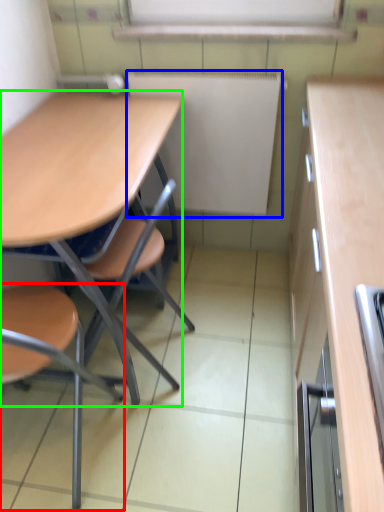
Question: Which is farther away from chair (highlighted by a red box)? bulletin board (highlighted by a blue box) or desk (highlighted by a green box)?

Choices:
 (A) bulletin board
 (B) desk

Answer: (A)